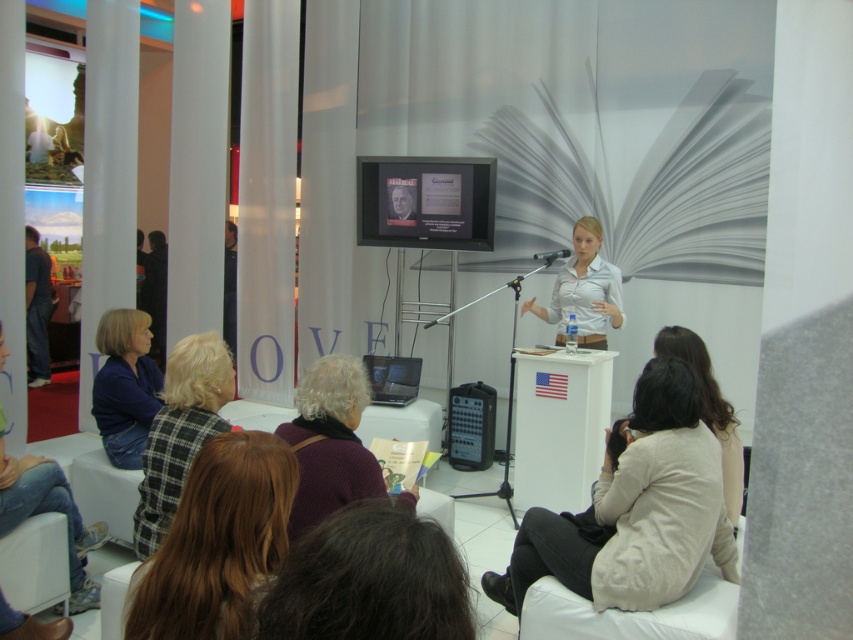
You are organizing a photo shoot and need to place two jackets in the scene. The blue fabric jacket at lower left and the dark fabric jacket at left must be positioned according to their sizes. Which jacket should you place first if you want to ensure both fit in the available space?

The blue fabric jacket at lower left occupies less space than the dark fabric jacket at left, so you should place the larger dark fabric jacket at left first to ensure both fit in the available space.

You are an event organizer who needs to arrange a photo shoot for the speaker. The photographer wants to ensure that both the light beige sweater at lower right and the dark fabric jacket at left are visible in the final shot. Based on their current positions, is there a way to frame the shot so both items are fully visible without any obstruction?

The light beige sweater at lower right is in front of the dark fabric jacket at left, so to ensure both are fully visible, the photographer should position the camera at an angle where the light beige sweater at lower right does not block the view of the dark fabric jacket at left. This can be achieved by adjusting the camera angle slightly to the side or moving the speaker slightly so both items are in clear view.